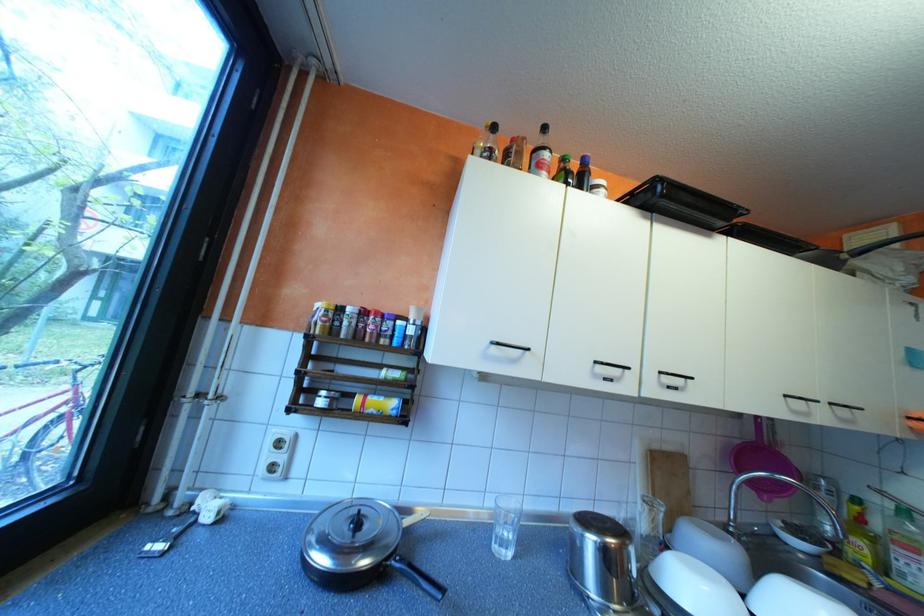
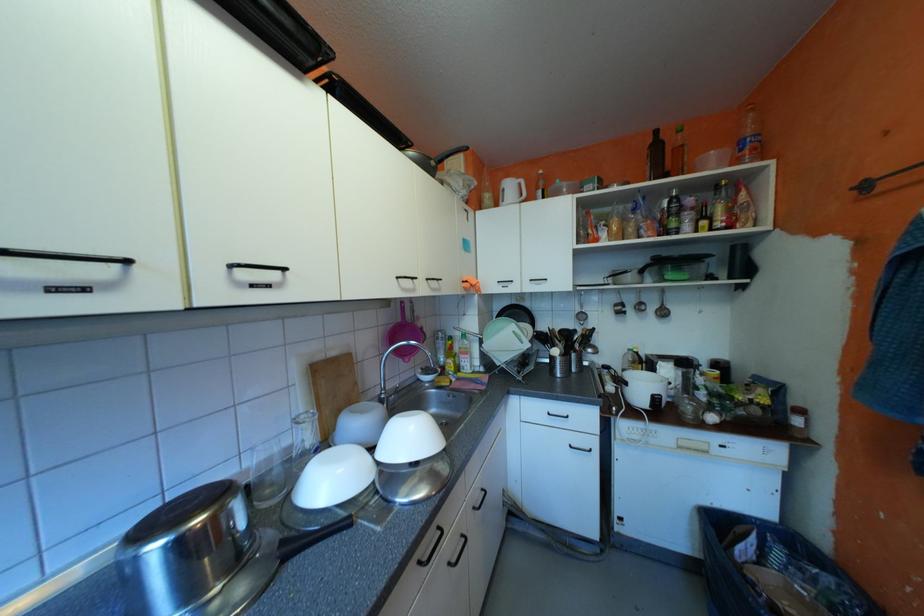
The first image is from the beginning of the video and the second image is from the end. How did the camera likely rotate when shooting the video?

The camera's rotation is toward right-down.